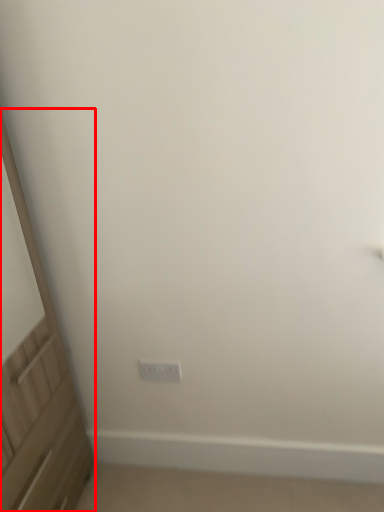
Question: In this image, where is screen door (annotated by the red box) located relative to electric outlet?

Choices:
 (A) left
 (B) right

Answer: (A)